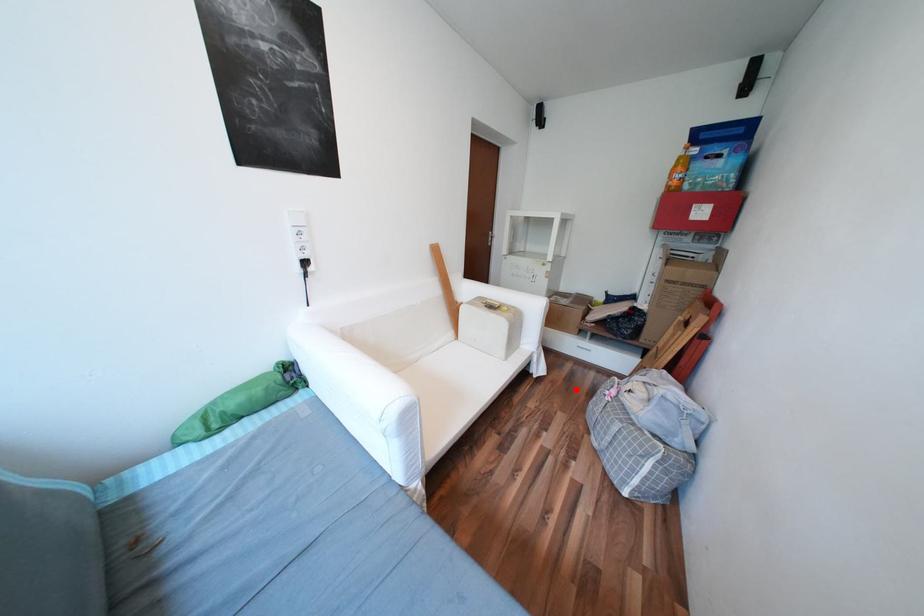
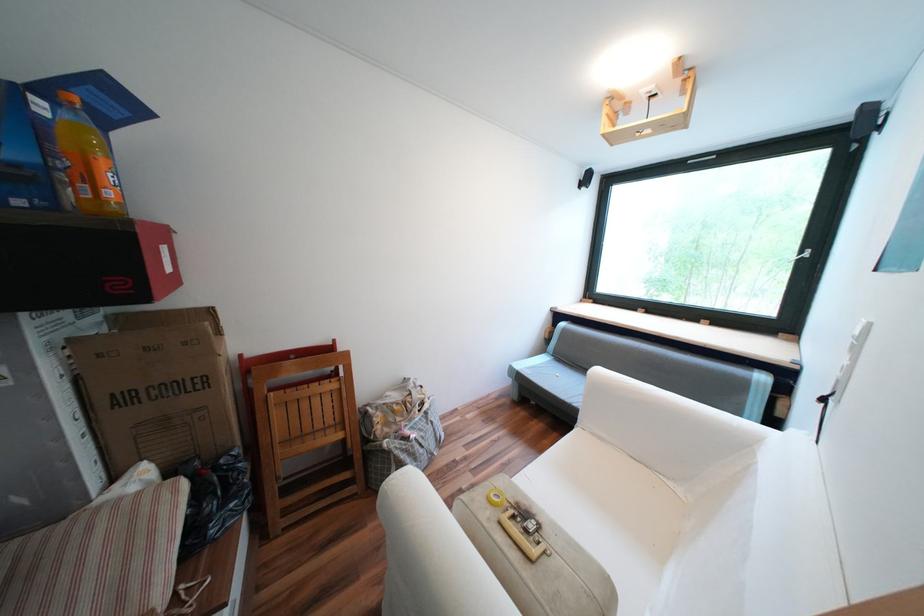
Question: I am providing you with two images of the same scene from different viewpoints. In image1, a red point is highlighted. Considering the same 3D point in image2, which of the following is correct?

Choices:
 (A) It is closer
 (B) It is farther

Answer: (B)